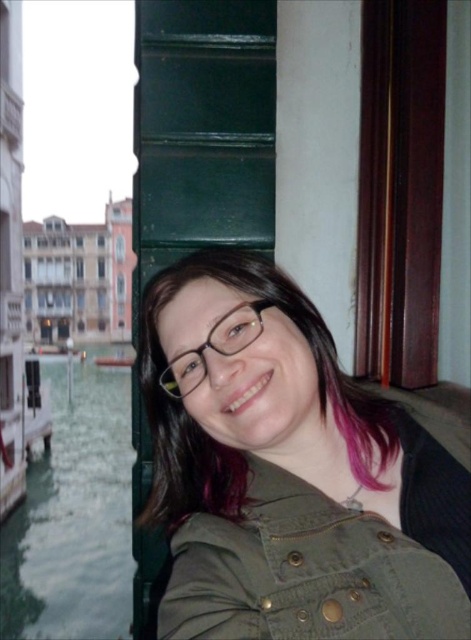
You are a photographer trying to capture the reflection of the canal in the green liquid water at lower left and the clear plastic glasses at center. Which object is closer to the camera lens?

The green liquid water at lower left is closer to the camera lens than the clear plastic glasses at center because it is further to the viewer according to the description.

You are a bartender preparing a drink for a customer. You have the green liquid water at lower left and the clear plastic glasses at center. Which one should you use to serve the drink?

The clear plastic glasses at center should be used to serve the drink, while the green liquid water at lower left is likely the beverage itself.